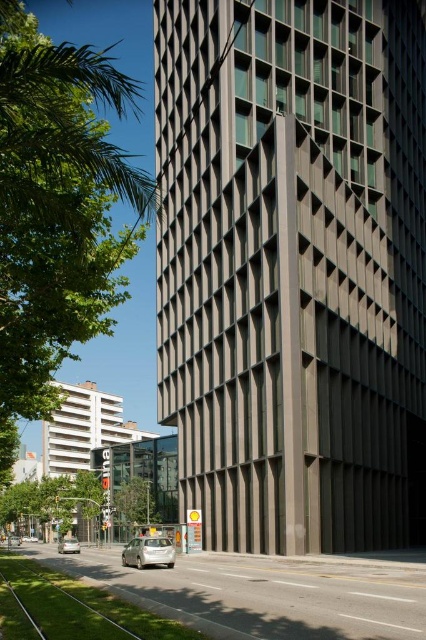
You are standing at the point marked by the coordinates point (134, 506) in the image. Looking towards the tall rectangular building, can you see the silver car on the road to the left of the building?

The point (134, 506) indicates a green leafy tree at lower center, which is likely blocking the view towards the silver car on the road to the left of the building. Therefore, you probably cannot see the silver car from that position.

You are a pedestrian standing on the sidewalk next to the road. You see the green leafy tree at lower center and the silver metallic car at lower center. Which object is closer to you?

The green leafy tree at lower center is closer to you because it is located below the silver metallic car at lower center, indicating it is positioned in front from your perspective.

You are standing in front of the tall building and want to determine the relative positions of two points marked in the image. Which point, point (x=60, y=108) or point (x=146, y=486), is closer to you?

Point (x=60, y=108) is closer to the viewer than point (x=146, y=486).